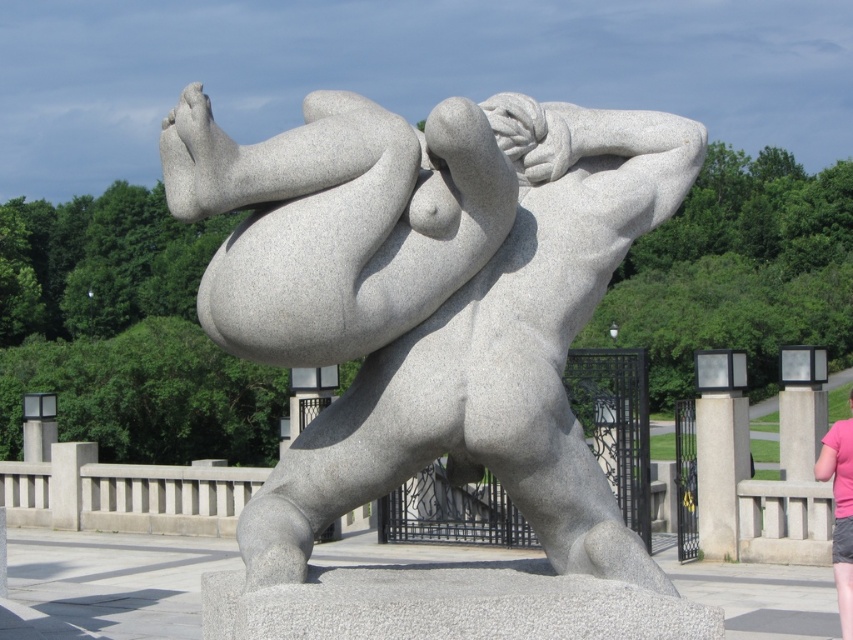
Does granite statue at center have a smaller size compared to pink fabric at lower right?

Correct, granite statue at center occupies less space than pink fabric at lower right.

Does point (610, 256) come in front of point (851, 564)?

Yes, point (610, 256) is in front of point (851, 564).

Identify the location of granite statue at center. (428, 298).